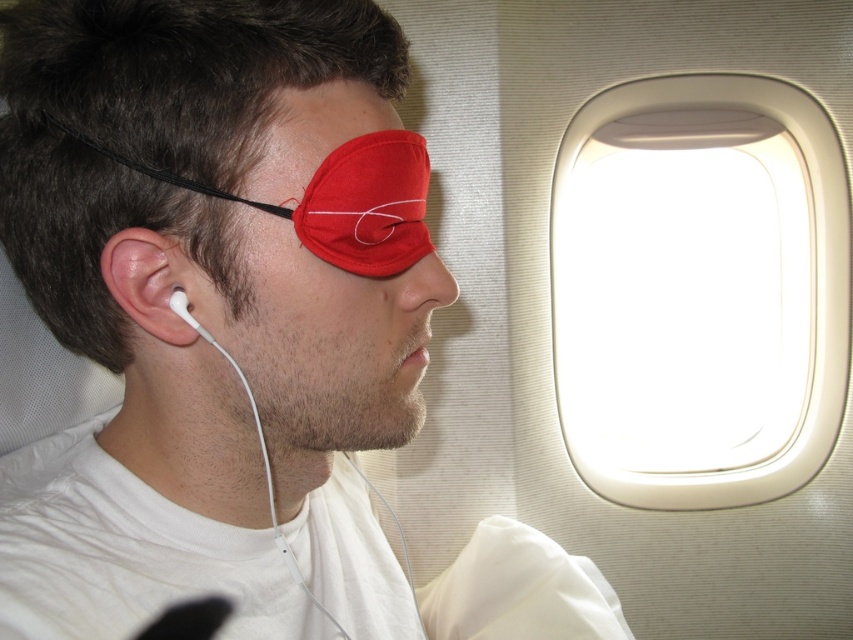
Who is positioned more to the left, red fabric eye mask at upper left or white matte earphone at left?

white matte earphone at left is more to the left.

Is red fabric eye mask at upper left further to camera compared to white matte earphone at left?

No, red fabric eye mask at upper left is in front of white matte earphone at left.

Between point (44, 113) and point (184, 310), which one is positioned behind?

Point (44, 113)

Find the location of a particular element. The height and width of the screenshot is (640, 853). red fabric eye mask at upper left is located at coordinates (340, 200).

Who is shorter, red fabric eye mask at upper left or white earbud at left?

white earbud at left

Between red fabric eye mask at upper left and white earbud at left, which one appears on the right side from the viewer's perspective?

red fabric eye mask at upper left is more to the right.

What do you see at coordinates (340, 200) in the screenshot? The width and height of the screenshot is (853, 640). I see `red fabric eye mask at upper left` at bounding box center [340, 200].

This screenshot has width=853, height=640. What are the coordinates of `red fabric eye mask at upper left` in the screenshot? It's located at (340, 200).

Can you confirm if white plastic airplane window at upper right is thinner than white matte earphone at left?

Incorrect, white plastic airplane window at upper right's width is not less than white matte earphone at left's.

Image resolution: width=853 pixels, height=640 pixels. What do you see at coordinates (699, 291) in the screenshot?
I see `white plastic airplane window at upper right` at bounding box center [699, 291].

Image resolution: width=853 pixels, height=640 pixels. In order to click on white plastic airplane window at upper right in this screenshot , I will do `click(699, 291)`.

The image size is (853, 640). Identify the location of white plastic airplane window at upper right. (699, 291).